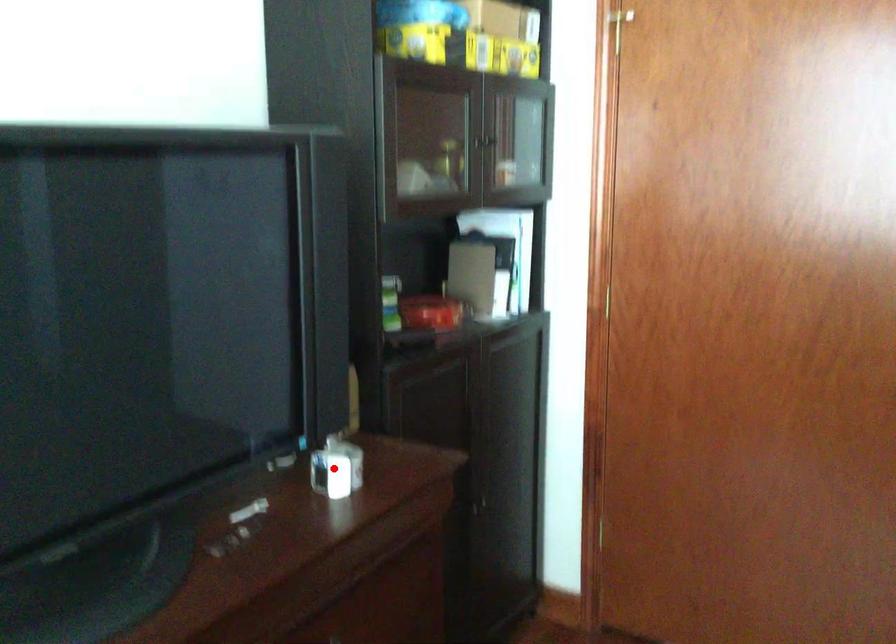
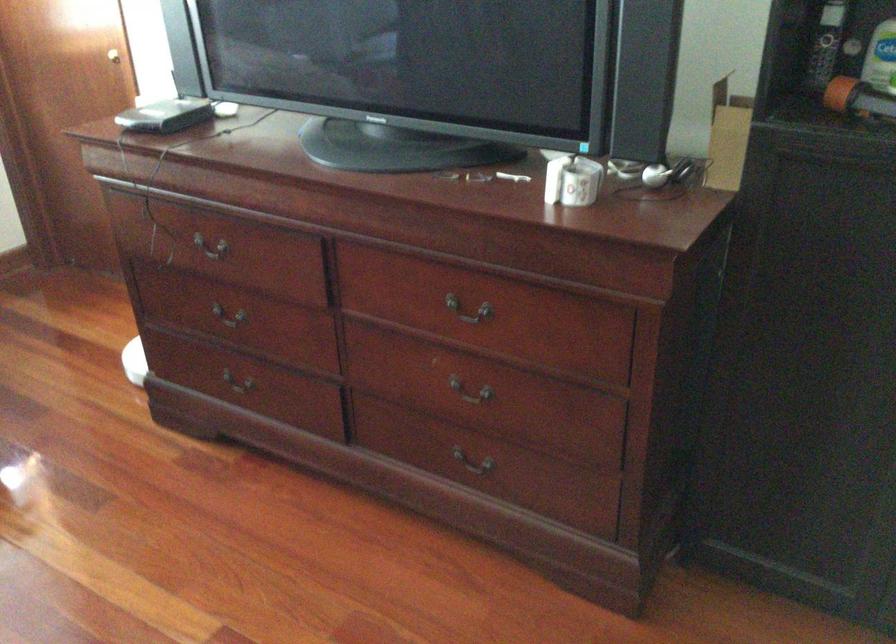
Find the pixel in the second image that matches the highlighted location in the first image.

(572, 180)